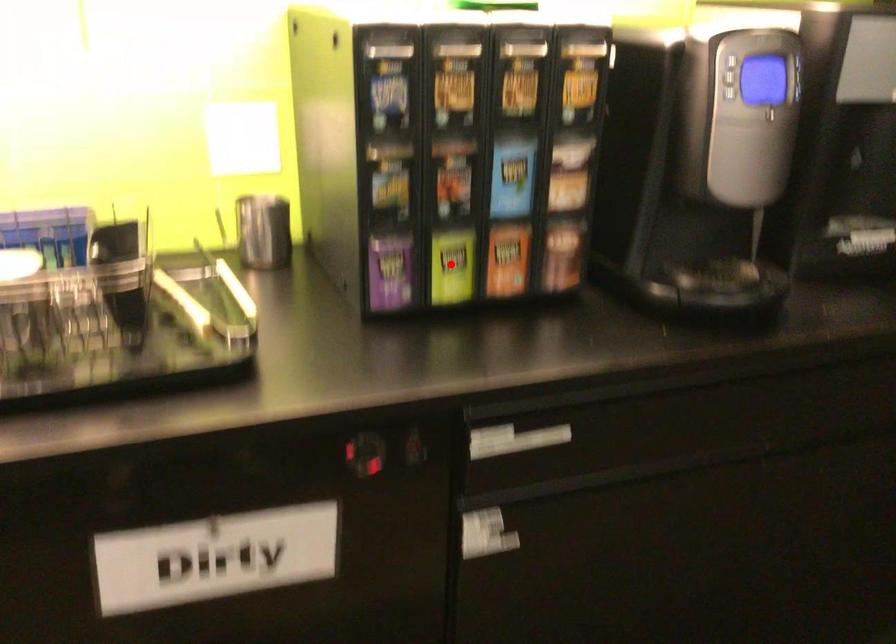
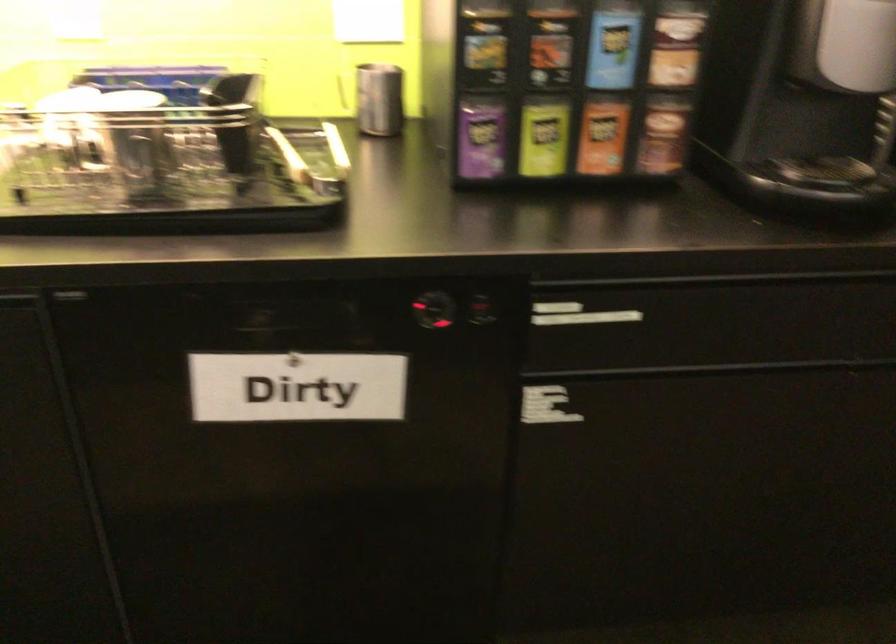
Find the pixel in the second image that matches the highlighted location in the first image.

(543, 138)